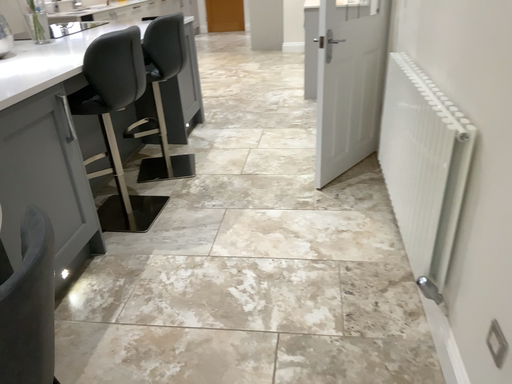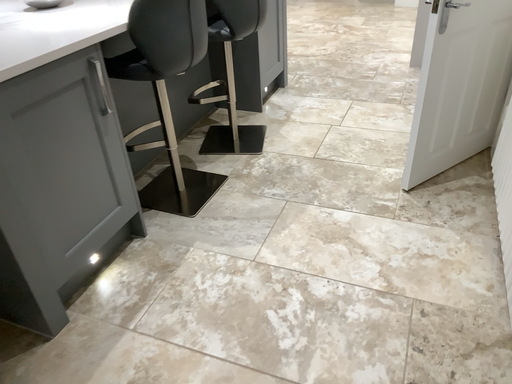
Question: Which way did the camera rotate in the video?

Choices:
 (A) rotated right
 (B) rotated left

Answer: (B)